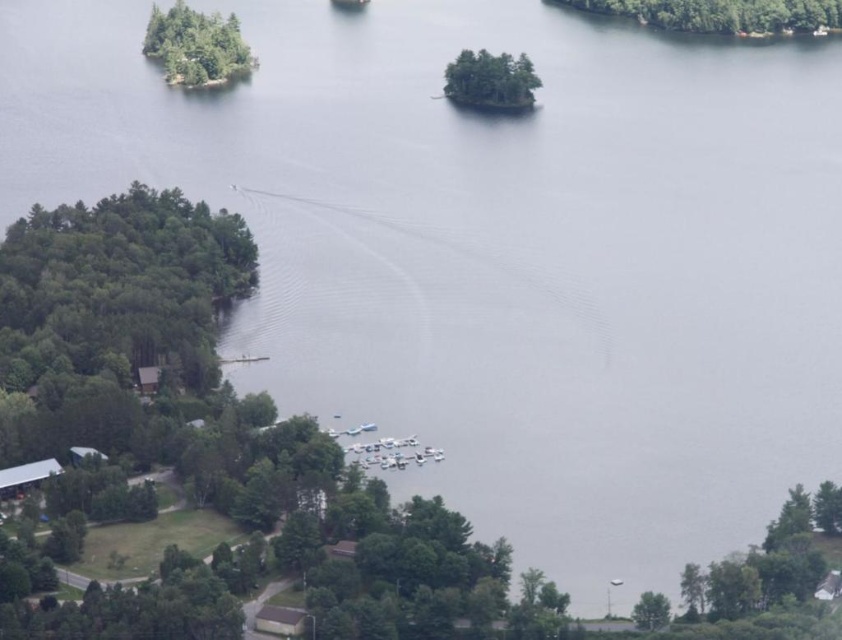
Question: Is green leafy trees at center smaller than green matte tree at lower right?

Choices:
 (A) yes
 (B) no

Answer: (B)

Question: Which point appears farthest from the camera in this image?

Choices:
 (A) (763, 577)
 (B) (481, 54)
 (C) (654, 627)
 (D) (791, 16)

Answer: (D)

Question: Does green leafy trees at center have a greater width compared to green matte tree at lower right?

Choices:
 (A) yes
 (B) no

Answer: (A)

Question: Which point appears farthest from the camera in this image?

Choices:
 (A) (189, 12)
 (B) (493, 77)
 (C) (645, 624)
 (D) (584, 8)

Answer: (A)

Question: Which point appears farthest from the camera in this image?

Choices:
 (A) [x=240, y=64]
 (B) [x=520, y=100]
 (C) [x=830, y=6]

Answer: (C)

Question: Is green leafy trees at upper left further to the viewer compared to green leafy trees at center?

Choices:
 (A) yes
 (B) no

Answer: (A)